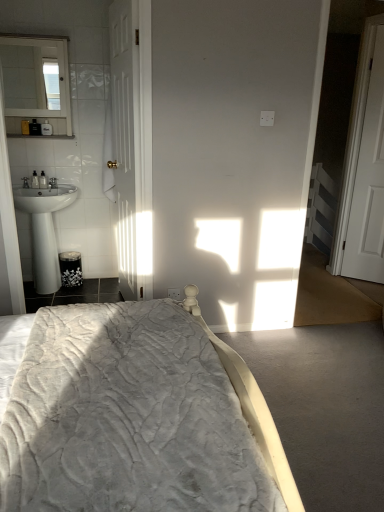
Identify the location of velvet grey bed at center. (137, 417).

The width and height of the screenshot is (384, 512). Find the location of `white wooden door at right, which appears as the 2th door when viewed from the left`. white wooden door at right, which appears as the 2th door when viewed from the left is located at coordinates (367, 173).

What do you see at coordinates (44, 230) in the screenshot?
I see `white glossy sink at left` at bounding box center [44, 230].

Find the location of `white wooden door at left, which is counted as the 2th door, starting from the right`. white wooden door at left, which is counted as the 2th door, starting from the right is located at coordinates (126, 135).

Could you tell me if white wooden door at right, which appears as the 2th door when viewed from the left, is turned towards white glossy sink at left?

No, white wooden door at right, which appears as the 2th door when viewed from the left, does not turn towards white glossy sink at left.

Which of these two, white wooden door at right, which appears as the 2th door when viewed from the left, or white glossy sink at left, stands shorter?

Standing shorter between the two is white glossy sink at left.

In the scene shown: Which is more to the right, white wooden door at right, placed as the 1th door when sorted from right to left, or white glossy sink at left?

white wooden door at right, placed as the 1th door when sorted from right to left.

Identify the location of sink on the left of white wooden door at right, placed as the 1th door when sorted from right to left. (44, 230).

Identify the location of door that is in front of the white glossy mirror at upper left. This screenshot has height=512, width=384. (126, 135).

How many degrees apart are the facing directions of white glossy mirror at upper left and white wooden door at left, which is counted as the 2th door, starting from the right?

The angle between the facing direction of white glossy mirror at upper left and the facing direction of white wooden door at left, which is counted as the 2th door, starting from the right, is 78 degrees.

Does white glossy mirror at upper left have a lesser width compared to white wooden door at left, the 1th door positioned from the left?

No, white glossy mirror at upper left is not thinner than white wooden door at left, the 1th door positioned from the left.

Is point (0, 36) closer or farther from the camera than point (127, 254)?

Point (0, 36) is closer to the camera than point (127, 254).

In terms of size, does white wooden door at left, the 1th door positioned from the left, appear bigger or smaller than white wooden door at right, placed as the 1th door when sorted from right to left?

In the image, white wooden door at left, the 1th door positioned from the left, appears to be larger than white wooden door at right, placed as the 1th door when sorted from right to left.

Is white wooden door at right, placed as the 1th door when sorted from right to left, a part of white wooden door at left, which is counted as the 2th door, starting from the right?

Definitely not — white wooden door at right, placed as the 1th door when sorted from right to left, is not inside white wooden door at left, which is counted as the 2th door, starting from the right.

Is white wooden door at left, the 1th door positioned from the left, behind white wooden door at right, which appears as the 2th door when viewed from the left?

No.

Do you think white glossy mirror at upper left is within white wooden door at right, which appears as the 2th door when viewed from the left, or outside of it?

white glossy mirror at upper left cannot be found inside white wooden door at right, which appears as the 2th door when viewed from the left.

Which object is further away from the camera taking this photo, white glossy mirror at upper left or white wooden door at right, placed as the 1th door when sorted from right to left?

Positioned behind is white wooden door at right, placed as the 1th door when sorted from right to left.

Can you confirm if white glossy mirror at upper left is positioned to the left of white wooden door at right, placed as the 1th door when sorted from right to left?

Correct, you'll find white glossy mirror at upper left to the left of white wooden door at right, placed as the 1th door when sorted from right to left.

From the image's perspective, is white glossy sink at left under velvet grey bed at center?

Actually, white glossy sink at left appears above velvet grey bed at center in the image.

Locate an element on the screen. Image resolution: width=384 pixels, height=512 pixels. sink beneath the velvet grey bed at center (from a real-world perspective) is located at coordinates (44, 230).

Would you say velvet grey bed at center is part of white glossy sink at left's contents?

No, velvet grey bed at center is not surrounded by white glossy sink at left.

From a real-world perspective, is velvet grey bed at center above or below white wooden door at right, placed as the 1th door when sorted from right to left?

velvet grey bed at center is situated lower than white wooden door at right, placed as the 1th door when sorted from right to left, in the real world.

Does velvet grey bed at center appear on the left side of white wooden door at right, placed as the 1th door when sorted from right to left?

Yes.

From the image's perspective, between velvet grey bed at center and white wooden door at right, which appears as the 2th door when viewed from the left, which one is located above?

white wooden door at right, which appears as the 2th door when viewed from the left, from the image's perspective.

Would you consider velvet grey bed at center to be distant from white wooden door at right, placed as the 1th door when sorted from right to left?

That's right, there is a large distance between velvet grey bed at center and white wooden door at right, placed as the 1th door when sorted from right to left.

Relative to white glossy mirror at upper left, is white wooden door at right, which appears as the 2th door when viewed from the left, in front or behind?

white wooden door at right, which appears as the 2th door when viewed from the left, is positioned farther from the viewer than white glossy mirror at upper left.

From the image's perspective, is white wooden door at right, which appears as the 2th door when viewed from the left, located beneath white glossy mirror at upper left?

Correct, white wooden door at right, which appears as the 2th door when viewed from the left, appears lower than white glossy mirror at upper left in the image.

From their relative heights in the image, would you say white wooden door at right, which appears as the 2th door when viewed from the left, is taller or shorter than white glossy mirror at upper left?

Clearly, white wooden door at right, which appears as the 2th door when viewed from the left, is taller compared to white glossy mirror at upper left.

Where is `sink lying on the left of white wooden door at right, which appears as the 2th door when viewed from the left`? sink lying on the left of white wooden door at right, which appears as the 2th door when viewed from the left is located at coordinates (44, 230).

I want to click on the 2nd door directly beneath the white glossy mirror at upper left (from a real-world perspective), so [126, 135].

Considering their positions, is velvet grey bed at center positioned further to white glossy mirror at upper left than white wooden door at right, which appears as the 2th door when viewed from the left?

white wooden door at right, which appears as the 2th door when viewed from the left, lies further to white glossy mirror at upper left than the other object.

When comparing their distances from velvet grey bed at center, does white glossy mirror at upper left or white wooden door at left, which is counted as the 2th door, starting from the right, seem further?

Based on the image, white glossy mirror at upper left appears to be further to velvet grey bed at center.

Looking at the image, which one is located closer to white glossy sink at left, velvet grey bed at center or white wooden door at right, which appears as the 2th door when viewed from the left?

Based on the image, velvet grey bed at center appears to be nearer to white glossy sink at left.

From the image, which object appears to be farther from velvet grey bed at center, white wooden door at left, the 1th door positioned from the left, or white glossy mirror at upper left?

Among the two, white glossy mirror at upper left is located further to velvet grey bed at center.

In the scene shown: When comparing their distances from white wooden door at left, the 1th door positioned from the left, does white wooden door at right, placed as the 1th door when sorted from right to left, or white glossy mirror at upper left seem further?

Among the two, white wooden door at right, placed as the 1th door when sorted from right to left, is located further to white wooden door at left, the 1th door positioned from the left.

From the image, which object appears to be nearer to velvet grey bed at center, white glossy sink at left or white glossy mirror at upper left?

Among the two, white glossy sink at left is located nearer to velvet grey bed at center.

Which object lies further to the anchor point white wooden door at left, the 1th door positioned from the left, white glossy sink at left or white wooden door at right, placed as the 1th door when sorted from right to left?

white wooden door at right, placed as the 1th door when sorted from right to left, is positioned further to the anchor white wooden door at left, the 1th door positioned from the left.

Looking at this image, looking at the image, which one is located further to white wooden door at left, the 1th door positioned from the left, white glossy sink at left or white glossy mirror at upper left?

white glossy sink at left.

Image resolution: width=384 pixels, height=512 pixels. I want to click on door between velvet grey bed at center and white wooden door at right, placed as the 1th door when sorted from right to left, from front to back, so 126,135.

Where is `sink between white glossy mirror at upper left and white wooden door at right, placed as the 1th door when sorted from right to left, from left to right`? The image size is (384, 512). sink between white glossy mirror at upper left and white wooden door at right, placed as the 1th door when sorted from right to left, from left to right is located at coordinates (44, 230).

At what (x,y) coordinates should I click in order to perform the action: click on door between velvet grey bed at center and white glossy mirror at upper left along the z-axis. Please return your answer as a coordinate pair (x, y). This screenshot has width=384, height=512. Looking at the image, I should click on (126, 135).

Where is `door between white glossy sink at left and white wooden door at right, placed as the 1th door when sorted from right to left, from left to right`? door between white glossy sink at left and white wooden door at right, placed as the 1th door when sorted from right to left, from left to right is located at coordinates (126, 135).